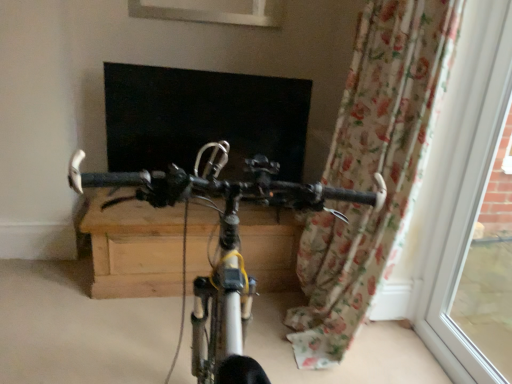
Question: In the image, is white plastic window frame at right positioned in front of or behind floral fabric curtain at right?

Choices:
 (A) behind
 (B) front

Answer: (B)

Question: From their relative heights in the image, would you say white plastic window frame at right is taller or shorter than floral fabric curtain at right?

Choices:
 (A) tall
 (B) short

Answer: (A)

Question: Which object is positioned farthest from the white plastic window frame at right?

Choices:
 (A) floral fabric curtain at right
 (B) metallic silver bicycle at center

Answer: (B)

Question: Based on their relative distances, which object is nearer to the floral fabric curtain at right?

Choices:
 (A) metallic silver bicycle at center
 (B) white plastic window frame at right

Answer: (B)